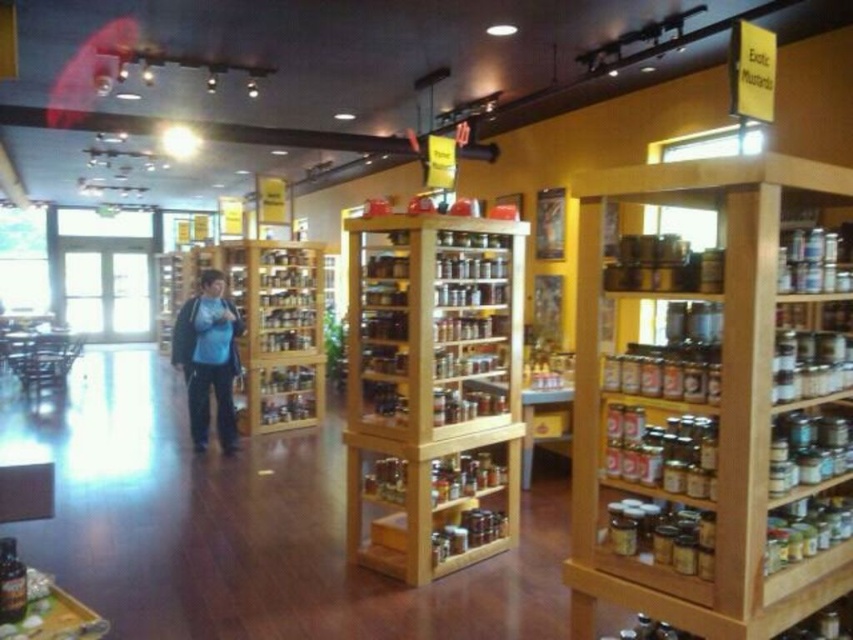
You are standing in the store and need to place a new jar of spices. The jar must be placed on the wooden spice rack at center. According to the store layout, where exactly should you position the jar?

The wooden spice rack at center is located at point (432, 392), so you should position the jar at those coordinates on the spice rack.